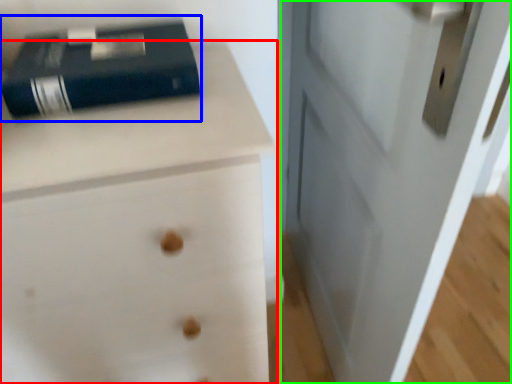
Question: Which is farther away from chest of drawers (highlighted by a red box)? paperback book (highlighted by a blue box) or door (highlighted by a green box)?

Choices:
 (A) paperback book
 (B) door

Answer: (B)